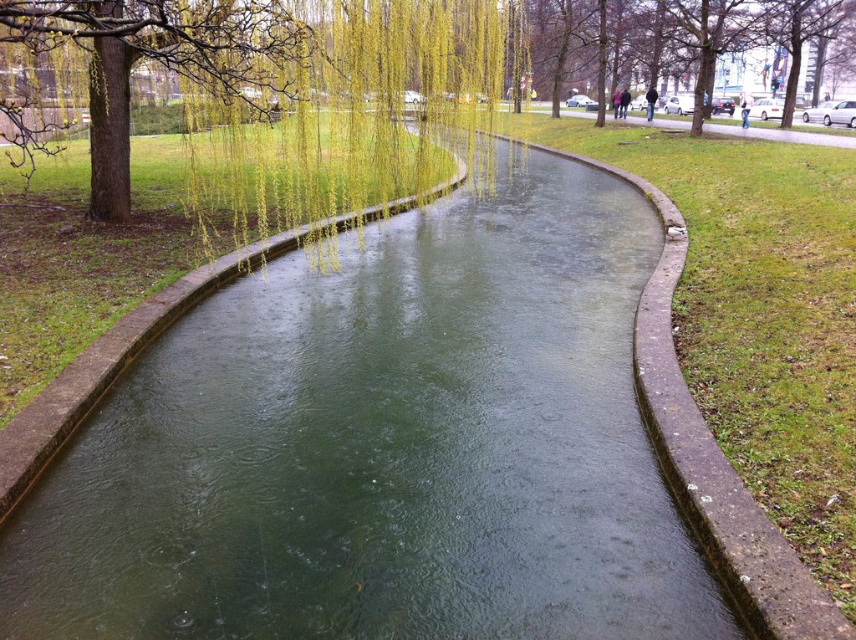
Question: Which object is farther from the camera taking this photo?

Choices:
 (A) brown textured tree at upper center
 (B) yellow-green leafy willow at upper left

Answer: (A)

Question: Is yellow-green leafy willow at upper left to the left of brown textured tree at upper center from the viewer's perspective?

Choices:
 (A) no
 (B) yes

Answer: (B)

Question: Is yellow-green leafy willow at upper left closer to camera compared to brown textured tree at upper center?

Choices:
 (A) yes
 (B) no

Answer: (A)

Question: Does yellow-green leafy willow at upper left lie in front of brown textured tree at upper center?

Choices:
 (A) no
 (B) yes

Answer: (B)